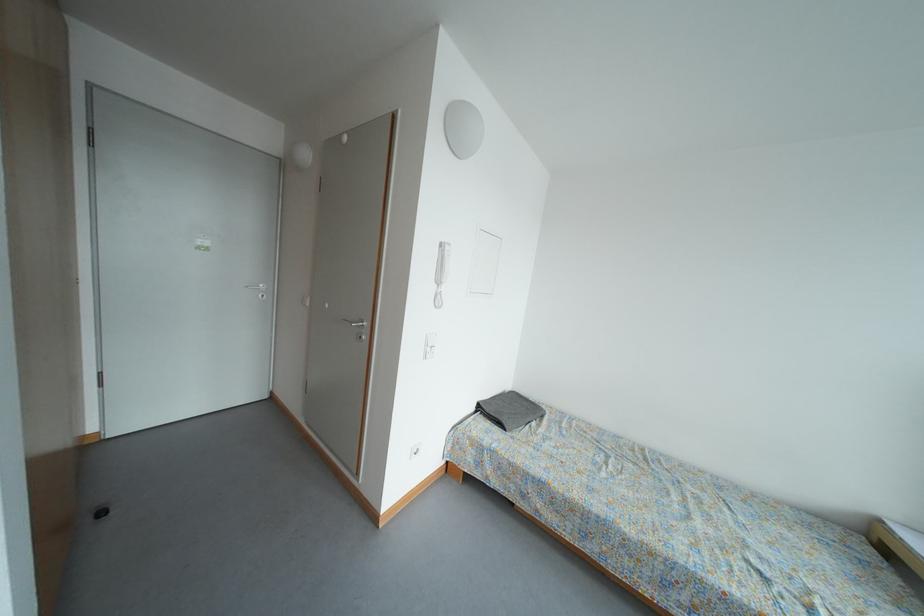
What do you see at coordinates (429, 345) in the screenshot? I see `the white light switch` at bounding box center [429, 345].